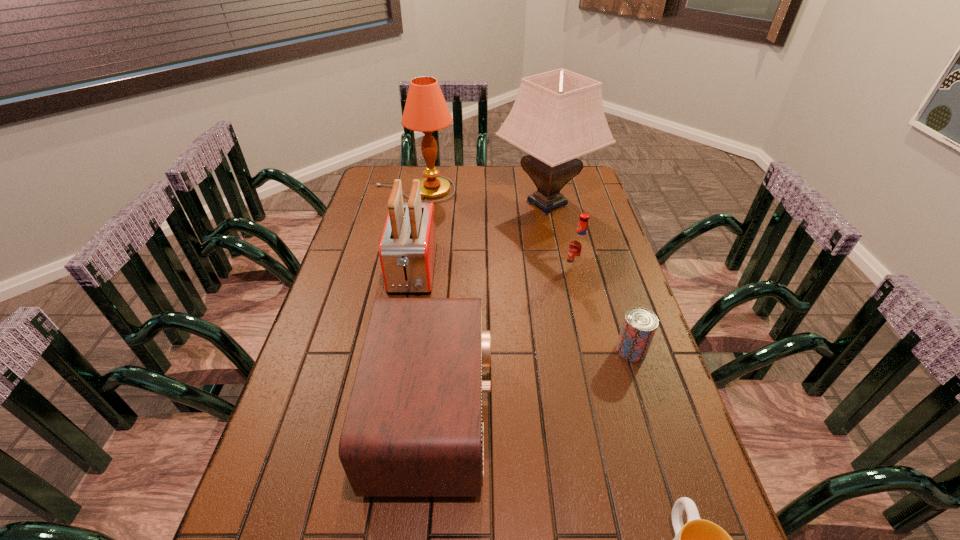
Identify the location of vacant space located 0.090m on the front panel of the radio receiver. (530, 416).

The image size is (960, 540). Identify the location of vacant area located 0.310m on the front of the beer can. (674, 485).

Where is `lampshade located at the far edge`? lampshade located at the far edge is located at coordinates [558, 116].

At what (x,y) coordinates should I click in order to perform the action: click on lamp situated at the far edge. Please return your answer as a coordinate pair (x, y). This screenshot has width=960, height=540. Looking at the image, I should click on (426, 111).

Find the location of a particular element. The height and width of the screenshot is (540, 960). object that is at the left edge is located at coordinates (426, 111).

At what (x,y) coordinates should I click in order to perform the action: click on lampshade that is at the right edge. Please return your answer as a coordinate pair (x, y). Image resolution: width=960 pixels, height=540 pixels. Looking at the image, I should click on (558, 116).

This screenshot has height=540, width=960. In order to click on root beer that is at the right edge in this screenshot , I will do `click(578, 250)`.

What are the coordinates of `beer can that is at the right edge` in the screenshot? It's located at tap(639, 326).

The width and height of the screenshot is (960, 540). What are the coordinates of `object that is at the far left corner` in the screenshot? It's located at 426,111.

Where is `object positioned at the far right corner`? object positioned at the far right corner is located at coordinates (558, 116).